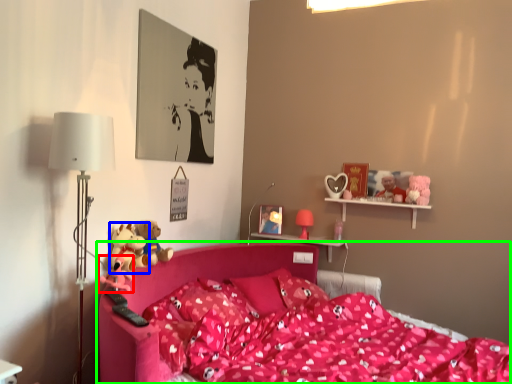
Question: Which is nearer to the toy (highlighted by a red box)? toy (highlighted by a blue box) or bed (highlighted by a green box).

Choices:
 (A) toy
 (B) bed

Answer: (A)